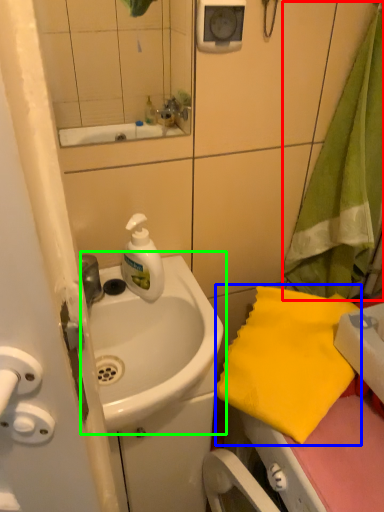
Question: Considering the real-world distances, which object is closest to beach towel (highlighted by a red box)? beach towel (highlighted by a blue box) or sink (highlighted by a green box).

Choices:
 (A) beach towel
 (B) sink

Answer: (A)